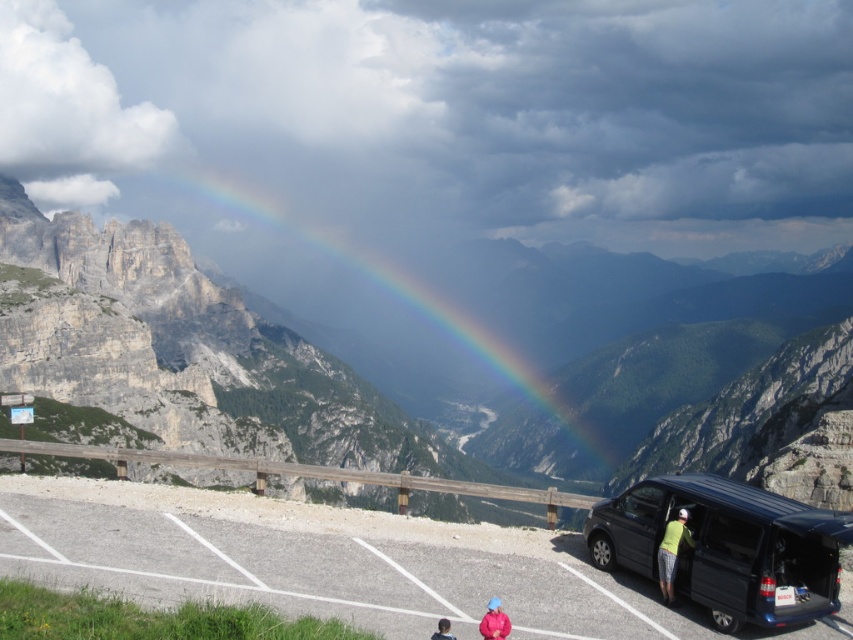
You are a photographer planning to capture the rainbow at upper center and the pink fabric jacket at lower center in the same frame. Considering their sizes, which object would appear wider in the photo?

The rainbow at upper center would appear wider in the photo because its width is larger than the pink fabric jacket at lower center.

You are standing at the parking area and want to walk from point (x=440, y=448) to point (x=489, y=600). Which direction should you face to move towards the correct point?

Point (x=440, y=448) is closer to you than point (x=489, y=600), so you should face away from the mountains to move towards the farther point.

You are a delivery driver who needs to park your matte black van at lower right in the parking area shown in the scene. The parking spot has a maximum length of 5 meters. Can you determine if your van will fit in the spot based on its position coordinates?

The position of matte black van at lower right is at point [727,547], but without knowing the dimensions of the parking spot or the van itself, it is impossible to determine if it will fit. Additional information about the van length or parking dimensions is required to make this assessment.